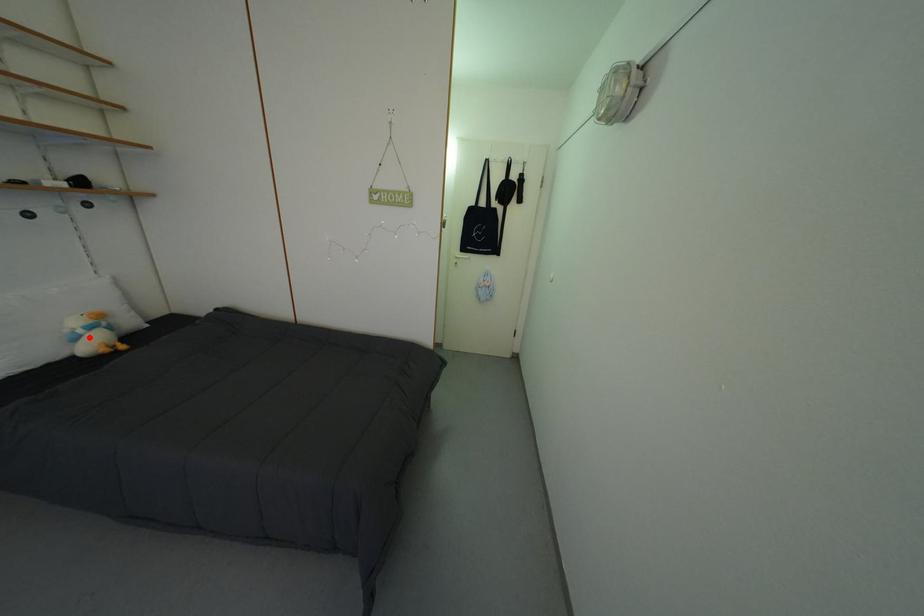
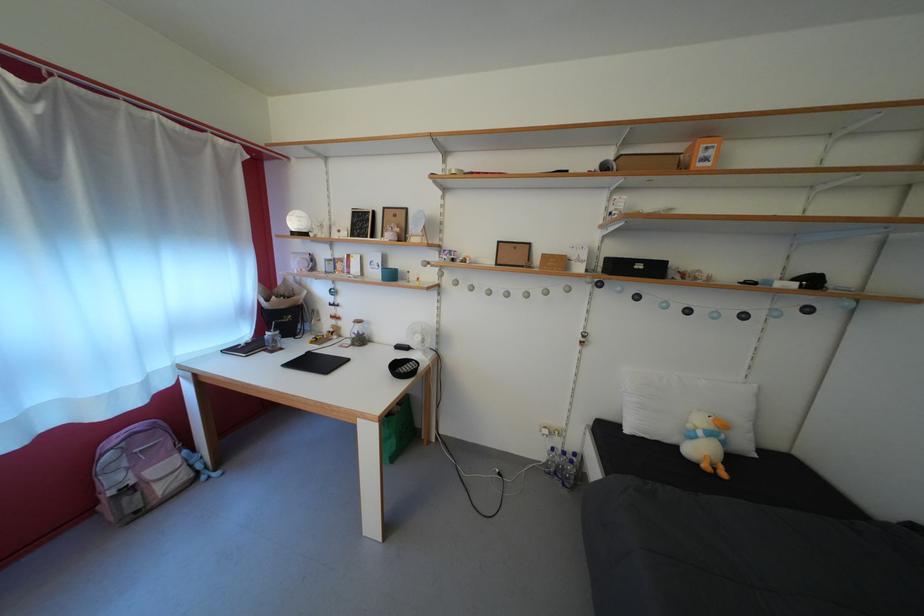
Locate, in the second image, the point that corresponds to the highlighted location in the first image.

(709, 439)